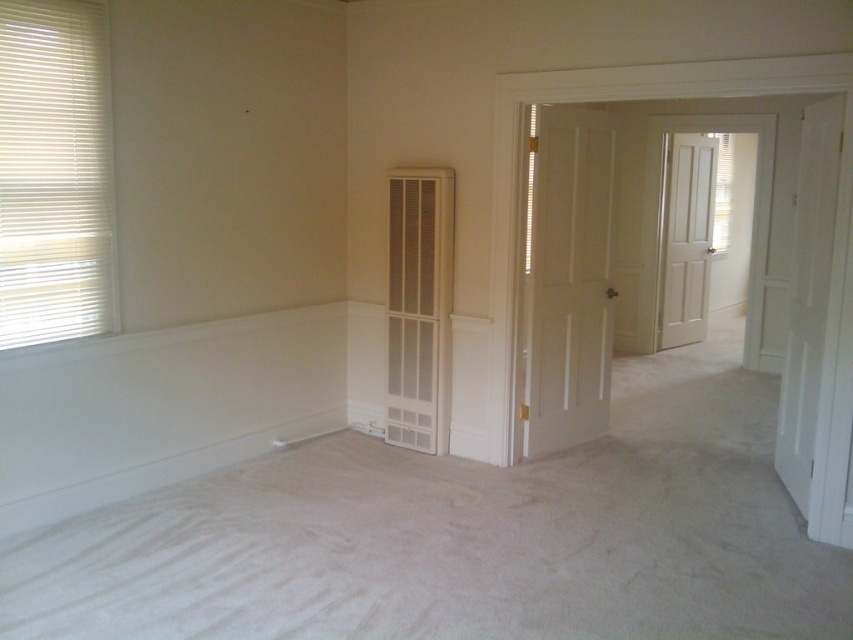
You are standing in the room and want to open the white matte door at center. To do so, you need to walk towards it. Which direction should you walk relative to the white blinds at left?

Since the white blinds at left is above the white matte door at center, the door is located below the blinds. Therefore, you should walk towards the bottom of the white blinds at left to reach the door.

You are standing in the room and want to exit through the back door. You see two white matte doors at center and white matte door at center right. Which door should you go through to reach the back of the room?

The white matte door at center right is behind the white matte door at center, so you should go through the white matte door at center right to reach the back of the room.